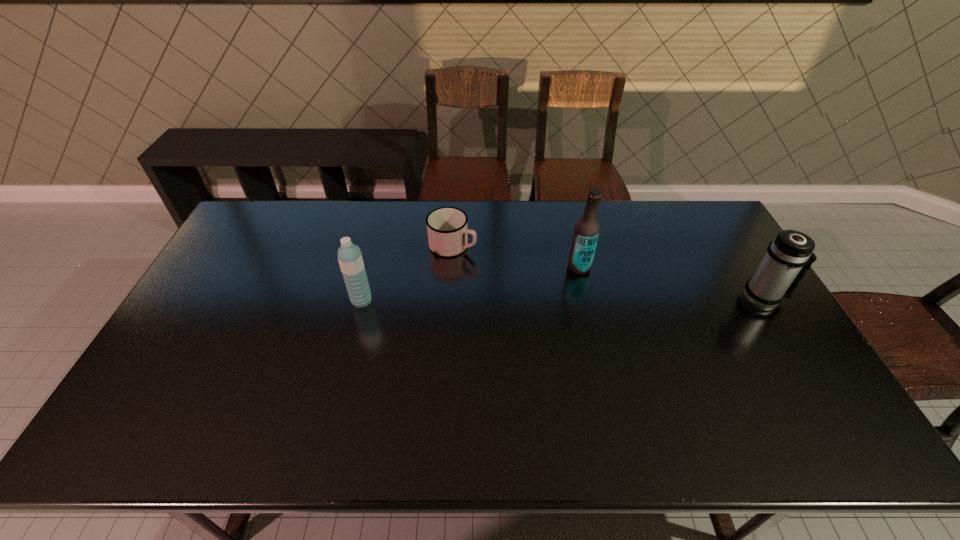
Locate an element on the screen. The height and width of the screenshot is (540, 960). vacant space on the desktop that is between the water bottle and the rightmost object and is positioned on the side of the third nearest object with the label is located at coordinates (527, 300).

Locate an element on the screen. vacant space on the desktop that is between the water bottle and the thermos bottle and is positioned on the side of the farthest object with the handle is located at coordinates (587, 299).